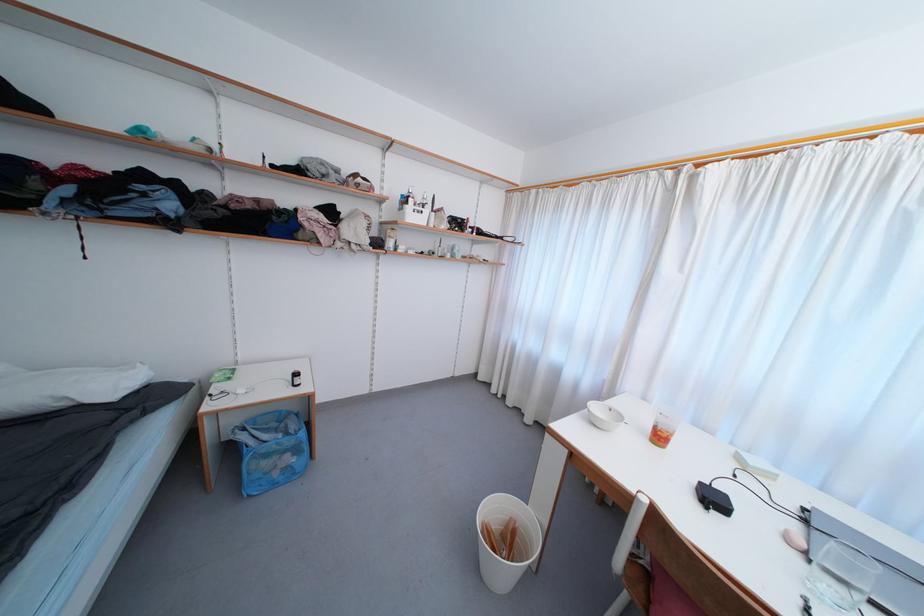
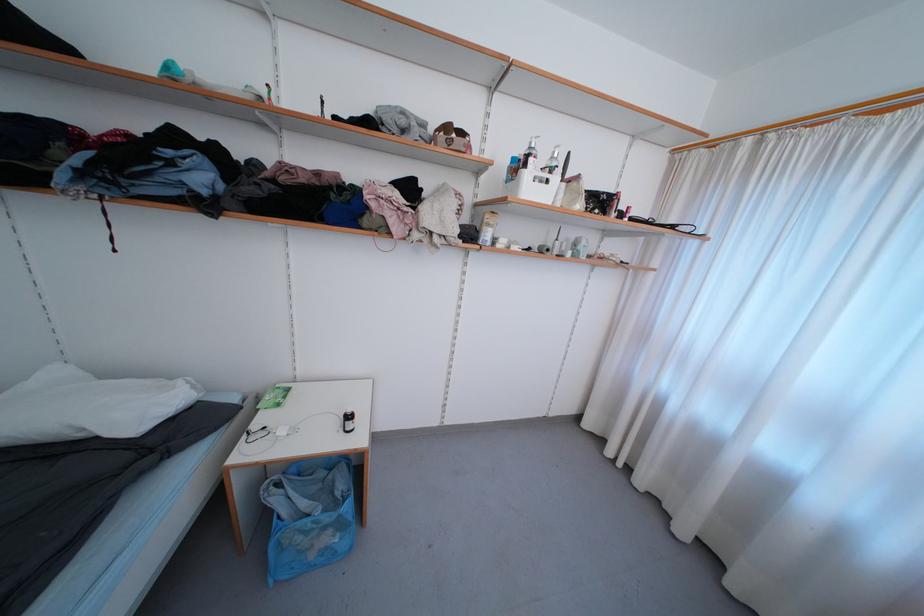
Locate, in the second image, the point that corresponds to the point at 412,209 in the first image.

(531, 177)